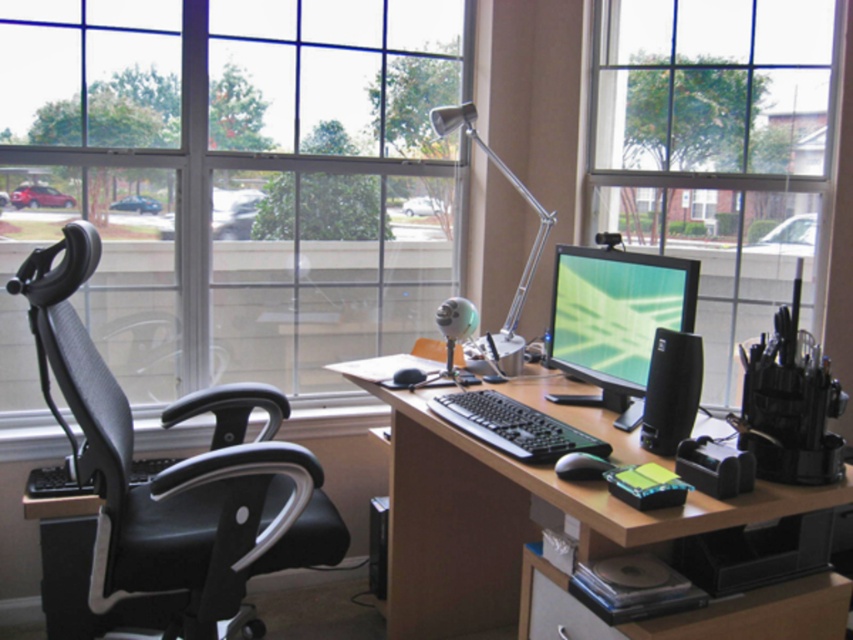
Question: Estimate the real-world distances between objects in this image. Which object is closer to the transparent glass window at center?

Choices:
 (A) matte black monitor at center
 (B) brown wood computer desk at center
 (C) black mesh swivel chair at left
 (D) metallic silver desk lamp at upper center

Answer: (D)

Question: Is matte black monitor at center further to the viewer compared to metallic silver desk lamp at upper center?

Choices:
 (A) no
 (B) yes

Answer: (A)

Question: Where is matte black monitor at center located in relation to metallic silver desk lamp at upper center in the image?

Choices:
 (A) right
 (B) left

Answer: (A)

Question: Based on their relative distances, which object is farther from the transparent glass window at center?

Choices:
 (A) brown wood computer desk at center
 (B) black mesh swivel chair at left

Answer: (A)

Question: Is clear glass window at upper right further to the viewer compared to matte black monitor at center?

Choices:
 (A) no
 (B) yes

Answer: (B)

Question: Which object is closer to the camera taking this photo?

Choices:
 (A) black mesh swivel chair at left
 (B) matte black monitor at center
 (C) clear glass window at upper right

Answer: (B)